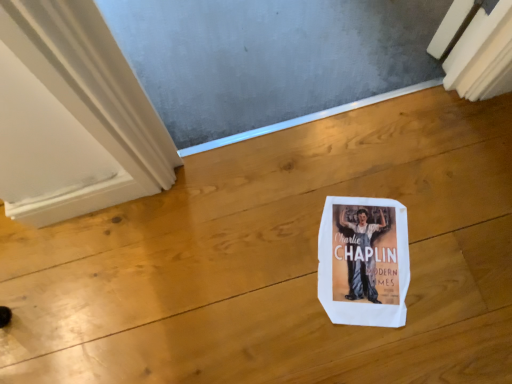
I want to click on free space in front of white paper bag at center, so click(x=395, y=347).